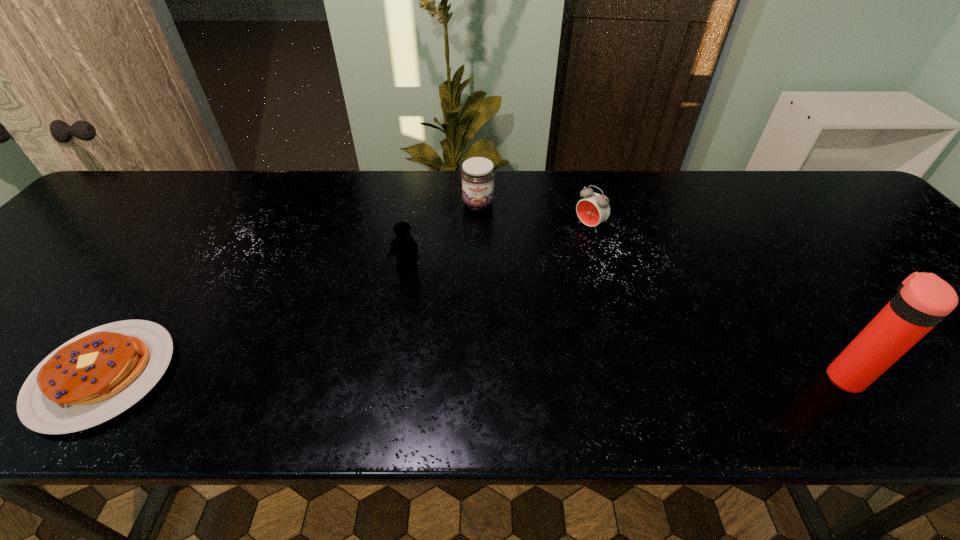
You are a GUI agent. You are given a task and a screenshot of the screen. Output one action in this format:
    pyautogui.click(x=<x>, y=<y>)
    Task: Click on the free space between the jam and the third farthest object
    The height and width of the screenshot is (540, 960).
    Given the screenshot: What is the action you would take?
    [x=443, y=235]

Find the location of a particular element. This screenshot has height=540, width=960. vacant region between the second object from left to right and the tallest object is located at coordinates (625, 321).

At what (x,y) coordinates should I click in order to perform the action: click on blank region between the rightmost object and the jam. Please return your answer as a coordinate pair (x, y). Looking at the image, I should click on (660, 290).

This screenshot has height=540, width=960. I want to click on empty space that is in between the farthest object and the fourth object from left to right, so click(x=534, y=215).

Identify which object is the nearest to the tallest object. Please provide its 2D coordinates. Your answer should be formatted as a tuple, i.e. [(x, y)], where the tuple contains the x and y coordinates of a point satisfying the conditions above.

[(593, 209)]

Select which object is the fourth closest to the leftmost object. Please provide its 2D coordinates. Your answer should be formatted as a tuple, i.e. [(x, y)], where the tuple contains the x and y coordinates of a point satisfying the conditions above.

[(923, 300)]